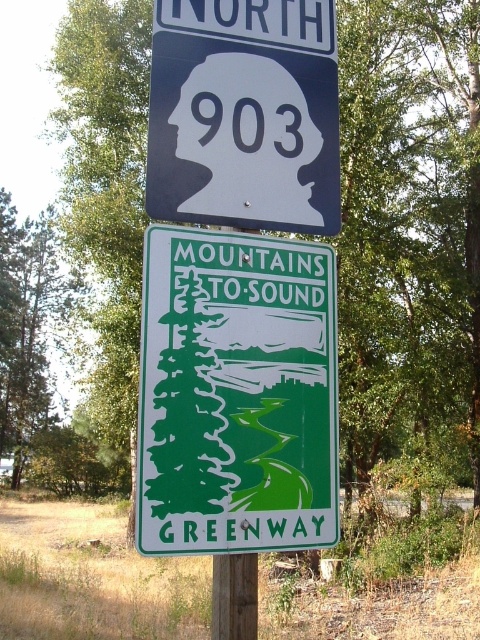
Does green matte sign at center have a greater width compared to matte blue sign at upper center?

No.

Is point (200, 236) farther from viewer compared to point (167, 86)?

No.

Measure the distance between green matte sign at center and camera.

green matte sign at center and camera are 2.03 meters apart from each other.

Locate an element on the screen. green matte sign at center is located at coordinates (237, 394).